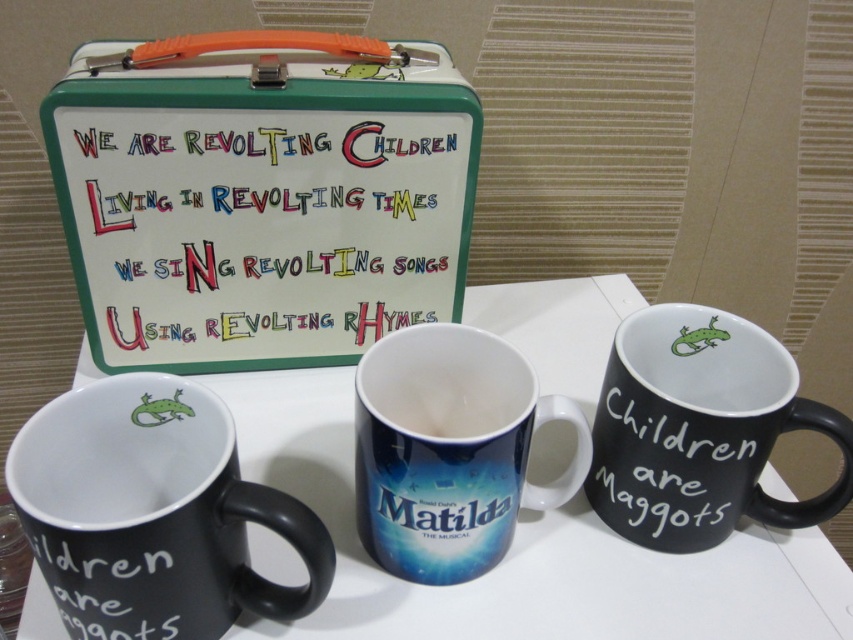
Question: Which object is the closest to the matte ceramic mug at center?

Choices:
 (A) black chalkboard mug at center right
 (B) black matte mugs at center

Answer: (B)

Question: Which point appears closest to the camera in this image?

Choices:
 (A) (115, 348)
 (B) (639, 422)
 (C) (368, 588)

Answer: (B)

Question: Does black chalkboard mug at lower left come behind matte ceramic mug at center?

Choices:
 (A) yes
 (B) no

Answer: (B)

Question: Is black chalkboard mug at center right positioned in front of matte ceramic mug at center?

Choices:
 (A) yes
 (B) no

Answer: (B)

Question: Which of the following is the farthest from the observer?

Choices:
 (A) (723, 440)
 (B) (415, 330)
 (C) (781, 563)

Answer: (C)

Question: Does black chalkboard mug at center right appear on the left side of matte ceramic mug at center?

Choices:
 (A) yes
 (B) no

Answer: (B)